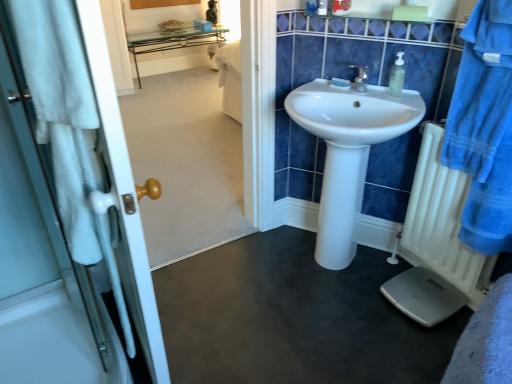
Locate an element on the screen. This screenshot has height=384, width=512. free region under white glossy sink at center (from a real-world perspective) is located at coordinates (336, 271).